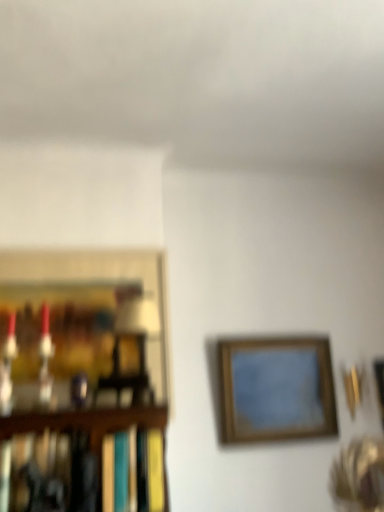
Question: In terms of height, does wooden frame at upper right, the third picture frame viewed from the left, look taller or shorter compared to wooden picture frame at left, which is counted as the 3th picture frame, starting from the right?

Choices:
 (A) short
 (B) tall

Answer: (A)

Question: Does point (380, 409) appear closer or farther from the camera than point (39, 289)?

Choices:
 (A) farther
 (B) closer

Answer: (A)

Question: Based on their relative distances, which object is nearer to the wooden framed picture at center, which is the second picture frame from right to left?

Choices:
 (A) wooden picture frame at left, which is counted as the 3th picture frame, starting from the right
 (B) hardcover book at left
 (C) wooden frame at upper right, the third picture frame viewed from the left

Answer: (C)

Question: Estimate the real-world distances between objects in this image. Which object is farther from the hardcover book at left?

Choices:
 (A) wooden frame at upper right, the third picture frame viewed from the left
 (B) wooden framed picture at center, which is the second picture frame from right to left
 (C) wooden picture frame at left, which is counted as the 3th picture frame, starting from the right

Answer: (A)